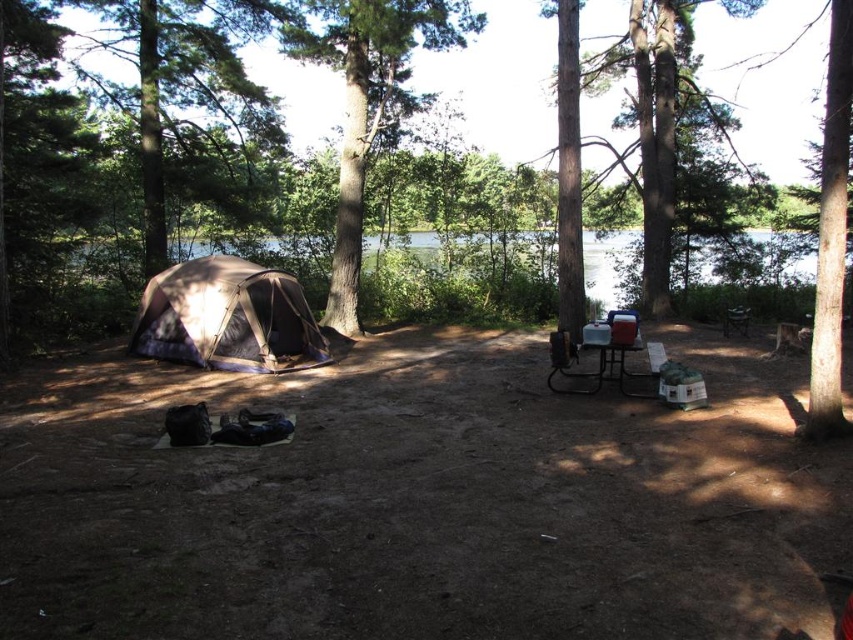
From the picture: Can you confirm if brown canvas tent at left is positioned below metallic silver picnic table at center?

No, brown canvas tent at left is not below metallic silver picnic table at center.

Who is more forward, (303, 333) or (566, 352)?

Positioned in front is point (566, 352).

Which is in front, point (190, 292) or point (602, 384)?

Point (602, 384) is more forward.

Find the location of `brown canvas tent at left`. brown canvas tent at left is located at coordinates point(228,317).

Who is positioned more to the right, green leafy tree at upper left or clear water at center?

clear water at center is more to the right.

Can you confirm if green leafy tree at upper left is smaller than clear water at center?

No.

You are a GUI agent. You are given a task and a screenshot of the screen. Output one action in this format:
    pyautogui.click(x=<x>, y=<y>)
    Task: Click on the green leafy tree at upper left
    
    Given the screenshot: What is the action you would take?
    pyautogui.click(x=190, y=99)

Is green leafy tree at upper left above brown canvas tent at left?

Correct, green leafy tree at upper left is located above brown canvas tent at left.

Does green leafy tree at upper left have a lesser width compared to brown canvas tent at left?

Incorrect, green leafy tree at upper left's width is not less than brown canvas tent at left's.

Identify the location of green leafy tree at upper left. The image size is (853, 640). (190, 99).